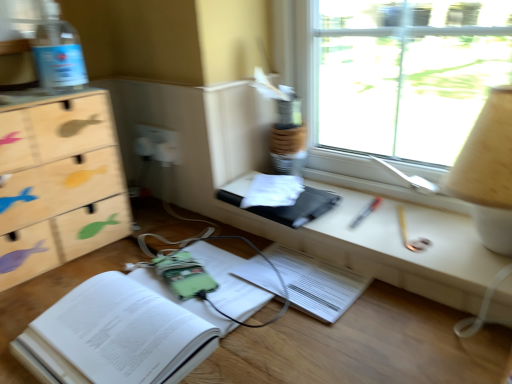
The height and width of the screenshot is (384, 512). Find the location of `unoccupied region to the right of black matte book at center, positioned as the 1th paperback book in top-to-bottom order`. unoccupied region to the right of black matte book at center, positioned as the 1th paperback book in top-to-bottom order is located at coordinates pos(367,200).